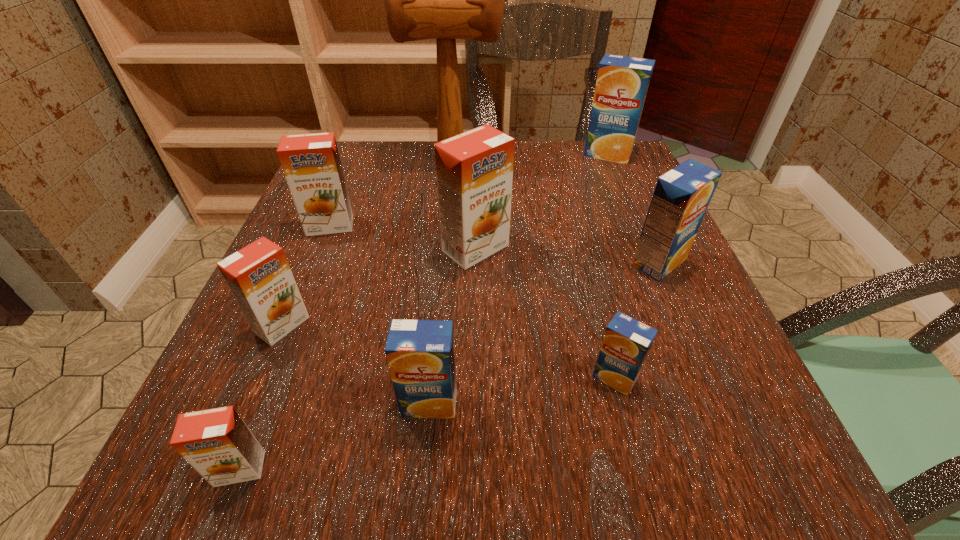
This screenshot has height=540, width=960. Identify the location of free space at the far left corner. (377, 193).

This screenshot has width=960, height=540. Identify the location of free space at the near left corner of the desktop. (284, 496).

This screenshot has height=540, width=960. In order to click on vacant space at the far right corner in this screenshot , I will do `click(644, 191)`.

Identify the location of free space between the nearest orange orange juice and the rightmost orange orange juice. (358, 359).

At what (x,y) coordinates should I click in order to perform the action: click on unoccupied position between the rightmost orange orange juice and the farthest orange juice. Please return your answer as a coordinate pair (x, y). Looking at the image, I should click on (541, 201).

Where is `empty location between the second biggest orange orange juice and the leftmost blue orange_juice`? The height and width of the screenshot is (540, 960). empty location between the second biggest orange orange juice and the leftmost blue orange_juice is located at coordinates (380, 314).

Identify the location of empty space that is in between the biggest blue orange_juice and the nearest orange orange juice. This screenshot has height=540, width=960. (423, 312).

Find the location of a particular element. The height and width of the screenshot is (540, 960). vacant space in between the smallest orange orange juice and the sixth orange juice from left to right is located at coordinates (427, 423).

Where is `unoccupied area between the second biggest orange orange juice and the seventh object from left to right`? Image resolution: width=960 pixels, height=540 pixels. unoccupied area between the second biggest orange orange juice and the seventh object from left to right is located at coordinates (472, 301).

Locate an element on the screen. The image size is (960, 540). empty space that is in between the third biggest blue orange_juice and the mallet is located at coordinates (441, 281).